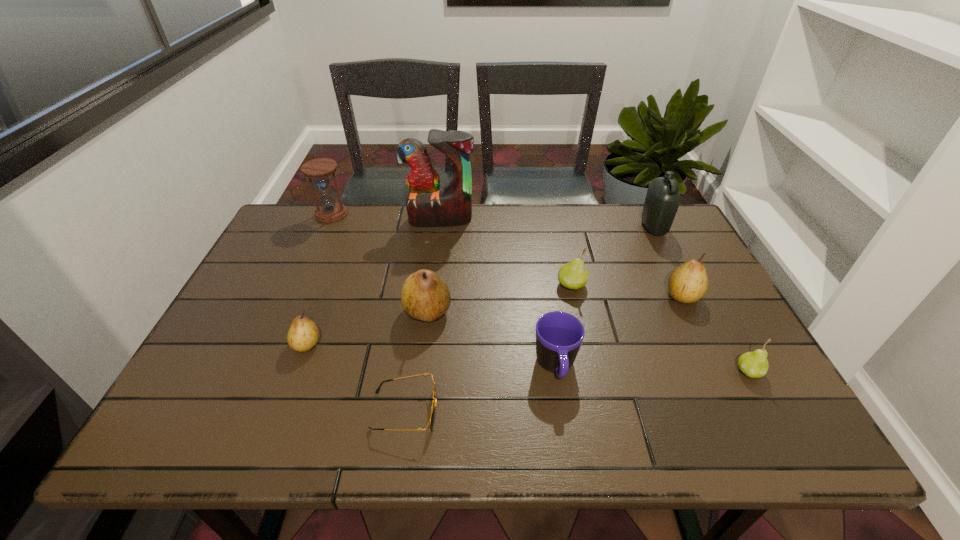
At what (x,y) coordinates should I click in order to perform the action: click on parrot. Please return your answer as a coordinate pair (x, y). Image resolution: width=960 pixels, height=540 pixels. Looking at the image, I should click on (428, 205).

I want to click on bottle, so click(x=662, y=200).

Image resolution: width=960 pixels, height=540 pixels. Find the location of `hourglass`. hourglass is located at coordinates (329, 211).

Find the location of a particular element. The height and width of the screenshot is (540, 960). the second pear from left to right is located at coordinates (x=425, y=296).

Locate an element on the screen. the second brown pear from right to left is located at coordinates (425, 296).

You are a GUI agent. You are given a task and a screenshot of the screen. Output one action in this format:
    pyautogui.click(x=<x>, y=<y>)
    Task: Click on the rightmost brown pear
    
    Given the screenshot: What is the action you would take?
    pyautogui.click(x=687, y=283)

This screenshot has height=540, width=960. I want to click on the farther green pear, so click(573, 275).

The image size is (960, 540). I want to click on the third pear from left to right, so click(x=573, y=275).

Locate an element on the screen. mug is located at coordinates (559, 335).

What are the coordinates of `the smallest brown pear` in the screenshot? It's located at (303, 334).